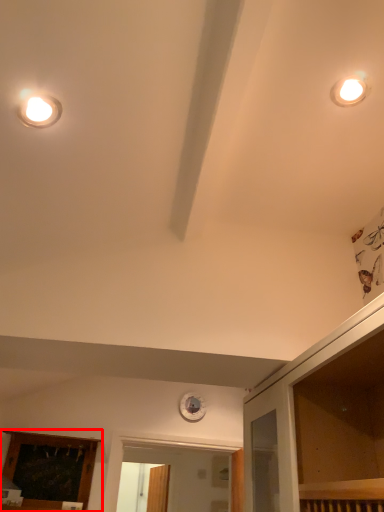
Question: Considering the relative positions of elevator (annotated by the red box) and dresser in the image provided, where is elevator (annotated by the red box) located with respect to the staircase?

Choices:
 (A) left
 (B) right

Answer: (A)